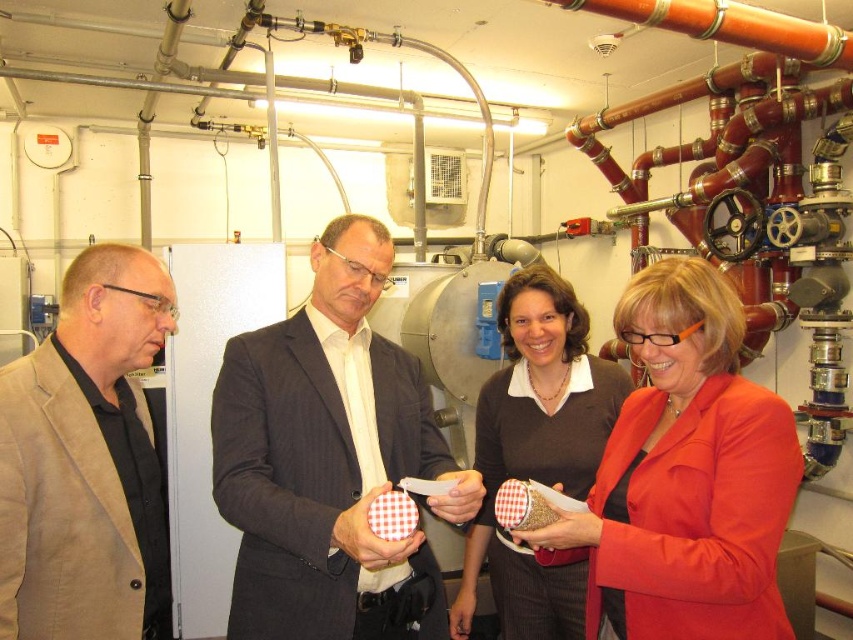
What do you see at coordinates (329, 460) in the screenshot?
I see `dark gray pinstripe suit at center` at bounding box center [329, 460].

Does dark gray pinstripe suit at center come behind beige fabric jacket at left?

Yes, it is.

The height and width of the screenshot is (640, 853). Find the location of `dark gray pinstripe suit at center`. dark gray pinstripe suit at center is located at coordinates (329, 460).

Is dark gray pinstripe suit at center taller than matte red blazer at center?

A: Yes, dark gray pinstripe suit at center is taller than matte red blazer at center.

Is dark gray pinstripe suit at center shorter than matte red blazer at center?

Incorrect, dark gray pinstripe suit at center's height does not fall short of matte red blazer at center's.

Who is more distant from viewer, [350,628] or [683,518]?

The point [350,628] is more distant.

This screenshot has height=640, width=853. I want to click on dark gray pinstripe suit at center, so click(x=329, y=460).

Which is in front, point (126, 580) or point (519, 602)?

Point (126, 580) is in front.

Who is more forward, (155, 572) or (492, 474)?

Positioned in front is point (155, 572).

Find the location of `beige fabric jacket at left`. beige fabric jacket at left is located at coordinates (86, 461).